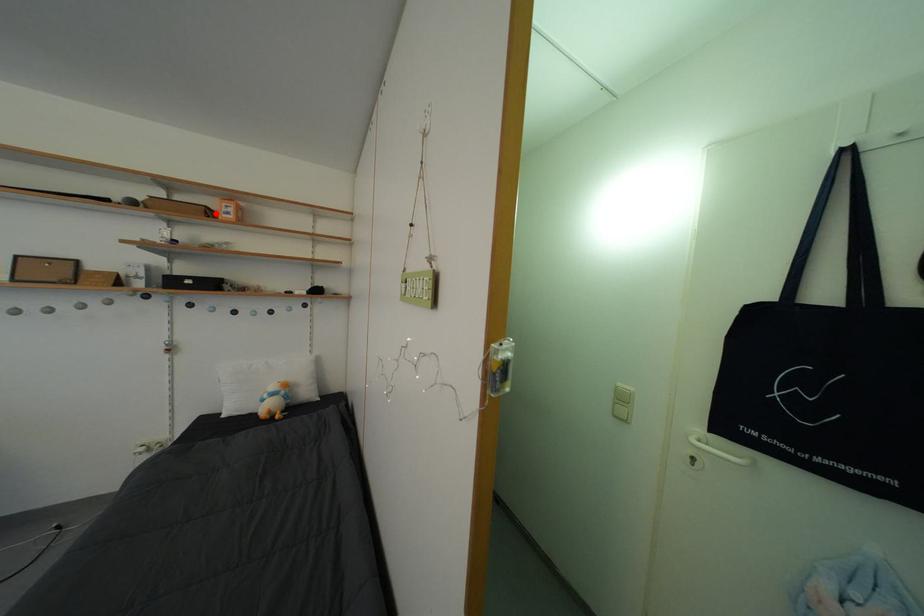
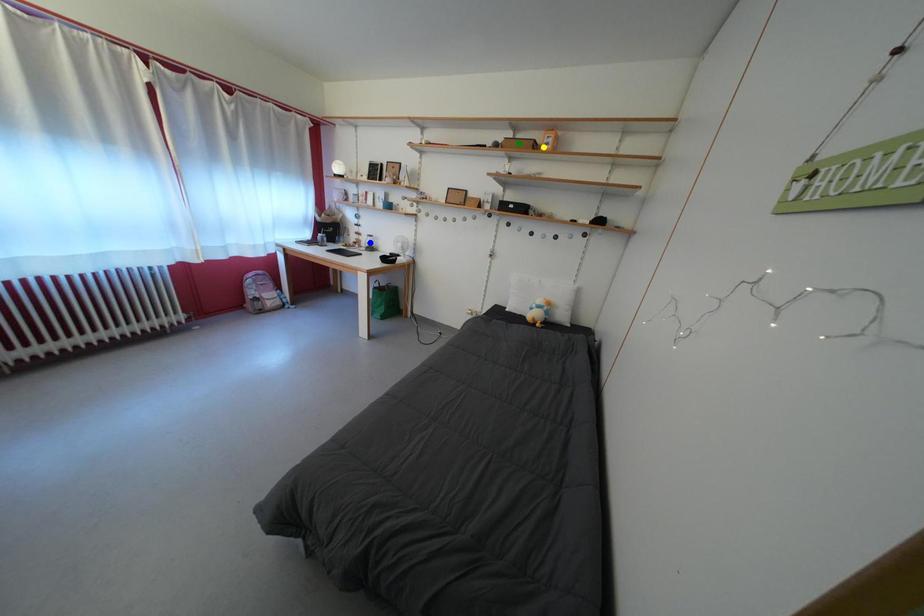
Question: I am providing you with two images of the same scene from different viewpoints. A red point is marked on the first image. You are given multiple points on the second image. In image 2, which mark is for the same physical point as the one in image 1?

Choices:
 (A) green point
 (B) blue point
 (C) yellow point

Answer: (C)